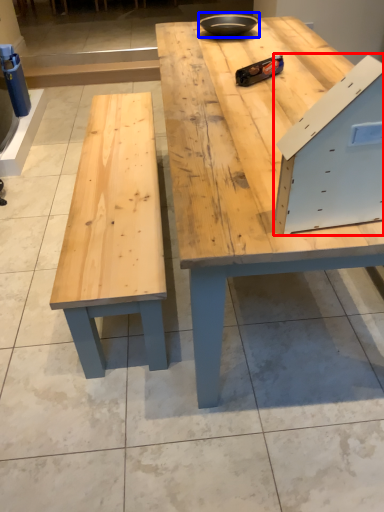
Question: Which object is closer to the camera taking this photo, drawer (highlighted by a red box) or bowl (highlighted by a blue box)?

Choices:
 (A) drawer
 (B) bowl

Answer: (A)